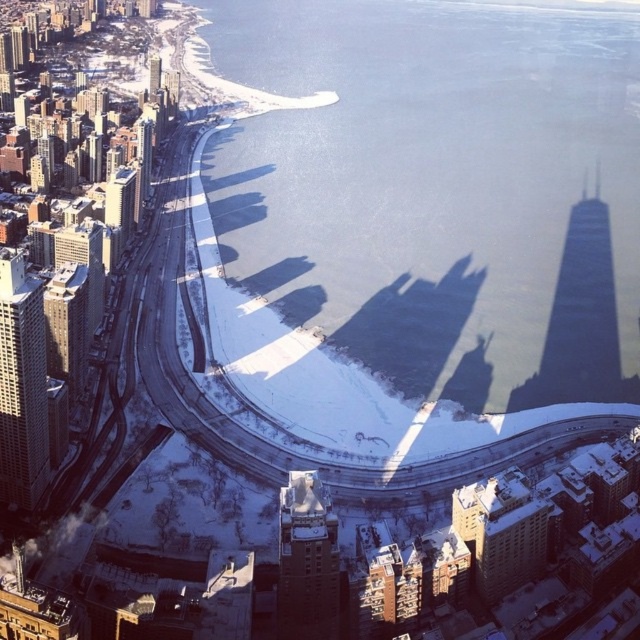
Between clear blue water at center and dark gray stone building at center, which one appears on the right side from the viewer's perspective?

From the viewer's perspective, clear blue water at center appears more on the right side.

Which is above, clear blue water at center or dark gray stone building at center?

Positioned higher is clear blue water at center.

Between point (372, 236) and point (321, 563), which one is positioned behind?

The point (372, 236) is behind.

Image resolution: width=640 pixels, height=640 pixels. Identify the location of clear blue water at center. [x=442, y=189].

Consider the image. Can you confirm if gray concrete skyscraper at left is smaller than dark gray stone building at center?

Incorrect, gray concrete skyscraper at left is not smaller in size than dark gray stone building at center.

Is gray concrete skyscraper at left in front of dark gray stone building at center?

No, gray concrete skyscraper at left is further to the viewer.

Between point (4, 481) and point (330, 566), which one is positioned in front?

Point (330, 566)

You are a GUI agent. You are given a task and a screenshot of the screen. Output one action in this format:
    pyautogui.click(x=<x>, y=<y>)
    Task: Click on the gray concrete skyscraper at left
    
    Given the screenshot: What is the action you would take?
    pyautogui.click(x=20, y=385)

Between clear blue water at center and gray concrete skyscraper at left, which one is positioned higher?

Positioned higher is clear blue water at center.

How distant is clear blue water at center from gray concrete skyscraper at left?

The distance of clear blue water at center from gray concrete skyscraper at left is 310.62 meters.

Is point (260, 189) closer to viewer compared to point (40, 396)?

No, (260, 189) is behind (40, 396).

Locate an element on the screen. clear blue water at center is located at coordinates (442, 189).